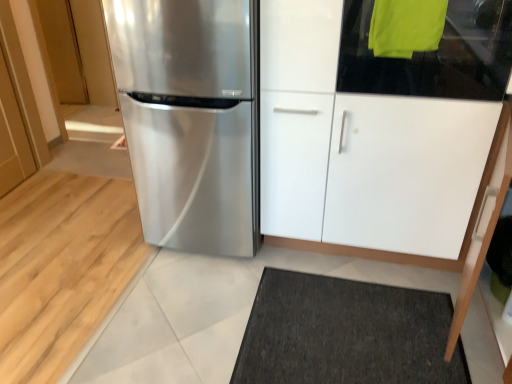
Question: Considering the relative sizes of white glossy cabinet at center and satin metallic refrigerator at center in the image provided, is white glossy cabinet at center smaller than satin metallic refrigerator at center?

Choices:
 (A) no
 (B) yes

Answer: (A)

Question: Are white glossy cabinet at center and satin metallic refrigerator at center making contact?

Choices:
 (A) yes
 (B) no

Answer: (B)

Question: Does white glossy cabinet at center have a greater width compared to satin metallic refrigerator at center?

Choices:
 (A) yes
 (B) no

Answer: (A)

Question: From a real-world perspective, is white glossy cabinet at center below satin metallic refrigerator at center?

Choices:
 (A) yes
 (B) no

Answer: (A)

Question: Is white glossy cabinet at center thinner than satin metallic refrigerator at center?

Choices:
 (A) no
 (B) yes

Answer: (A)

Question: Is satin metallic refrigerator at center in front of or behind transparent glass door at upper right in the image?

Choices:
 (A) behind
 (B) front

Answer: (A)

Question: Considering the positions of satin metallic refrigerator at center and transparent glass door at upper right in the image, is satin metallic refrigerator at center bigger or smaller than transparent glass door at upper right?

Choices:
 (A) small
 (B) big

Answer: (B)

Question: Do you think satin metallic refrigerator at center is within transparent glass door at upper right, or outside of it?

Choices:
 (A) outside
 (B) inside

Answer: (A)

Question: From a real-world perspective, is satin metallic refrigerator at center physically located above or below transparent glass door at upper right?

Choices:
 (A) below
 (B) above

Answer: (A)

Question: Is point (347, 16) closer or farther from the camera than point (238, 132)?

Choices:
 (A) closer
 (B) farther

Answer: (A)

Question: From the image's perspective, is transparent glass door at upper right positioned above or below satin metallic refrigerator at center?

Choices:
 (A) below
 (B) above

Answer: (B)

Question: Is transparent glass door at upper right wider or thinner than satin metallic refrigerator at center?

Choices:
 (A) thin
 (B) wide

Answer: (A)

Question: Is transparent glass door at upper right bigger or smaller than satin metallic refrigerator at center?

Choices:
 (A) big
 (B) small

Answer: (B)

Question: Would you say transparent glass door at upper right is to the left or to the right of white glossy cabinet at center in the picture?

Choices:
 (A) right
 (B) left

Answer: (A)

Question: Is transparent glass door at upper right wider or thinner than white glossy cabinet at center?

Choices:
 (A) wide
 (B) thin

Answer: (B)